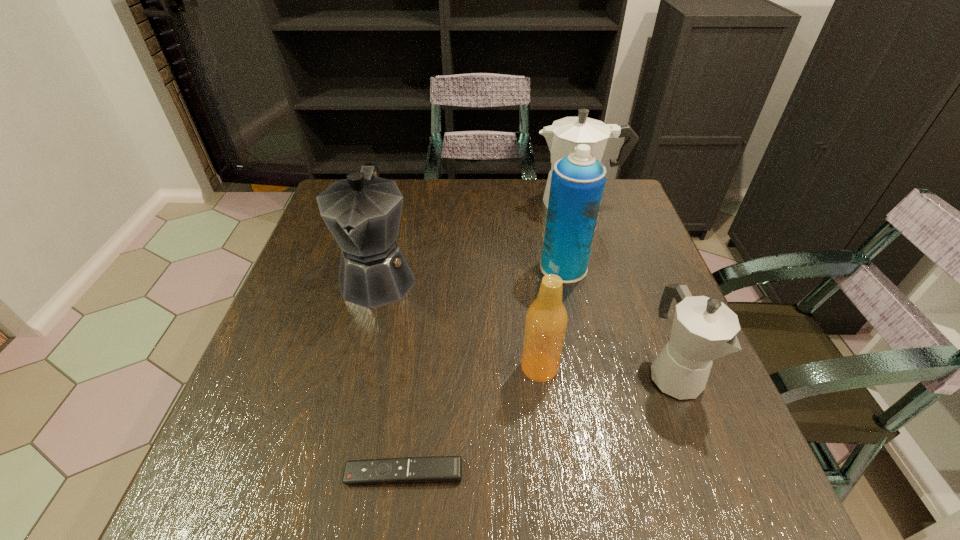
I want to click on vacant space located at the spout of the farthest object, so click(x=502, y=203).

In order to click on vacant space situated 0.280m at the spout of the farthest object in this screenshot , I will do `click(438, 203)`.

I want to click on blank space located on the front of the beer bottle, so click(x=553, y=478).

I want to click on vacant space located on the back of the nearest coffeepot, so click(621, 235).

At what (x,y) coordinates should I click in order to perform the action: click on blank area located 0.260m on the right of the shortest object. Please return your answer as a coordinate pair (x, y). The width and height of the screenshot is (960, 540). Looking at the image, I should click on (620, 473).

At what (x,y) coordinates should I click in order to perform the action: click on object that is positioned at the far edge. Please return your answer as a coordinate pair (x, y). The width and height of the screenshot is (960, 540). Looking at the image, I should click on (562, 137).

Locate an element on the screen. The width and height of the screenshot is (960, 540). object at the near edge is located at coordinates (438, 469).

Locate an element on the screen. object that is at the left edge is located at coordinates (363, 212).

Find the location of a particular element. The image size is (960, 540). object at the far right corner is located at coordinates (562, 137).

I want to click on free space at the far edge of the desktop, so click(428, 192).